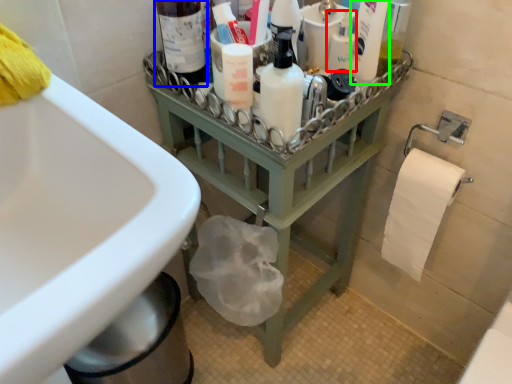
Question: Based on their relative distances, which object is farther from mouthwash (highlighted by a red box)? Choose from bottle (highlighted by a blue box) and cleaning product (highlighted by a green box).

Choices:
 (A) bottle
 (B) cleaning product

Answer: (A)